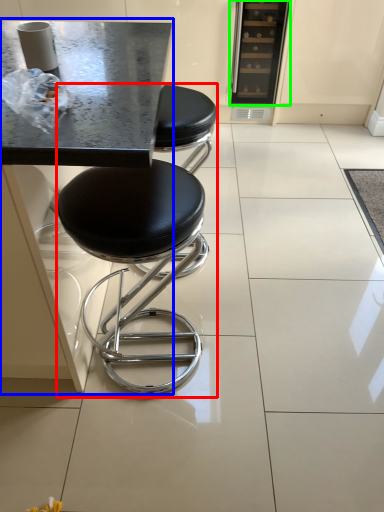
Question: Which object is positioned closest to stool (highlighted by a red box)? Select from round table (highlighted by a blue box) and appliance (highlighted by a green box).

Choices:
 (A) round table
 (B) appliance

Answer: (A)